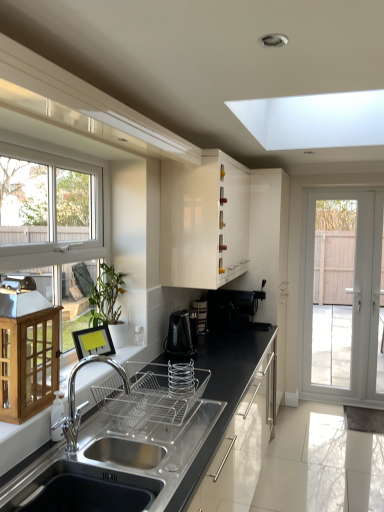
Question: In which direction should I rotate to look at black glossy electric kettle at center, which is the third appliance in back-to-front order?

Choices:
 (A) right
 (B) left

Answer: (B)

Question: Is white glossy cabinet at upper center, which ranks as the 2th cabinetry in bottom-to-top order, wider than black glossy electric kettle at center, the 2th appliance when ordered from front to back?

Choices:
 (A) yes
 (B) no

Answer: (A)

Question: Is white glossy cabinet at upper center, the second cabinetry when ordered from left to right, facing towards black glossy electric kettle at center, which is the third appliance in back-to-front order?

Choices:
 (A) no
 (B) yes

Answer: (A)

Question: Can you see white glossy cabinet at upper center, the 1th cabinetry when ordered from back to front, touching black glossy electric kettle at center, which is the third appliance in back-to-front order?

Choices:
 (A) no
 (B) yes

Answer: (A)

Question: Is white glossy cabinet at upper center, which ranks as the 2th cabinetry in bottom-to-top order, oriented away from black glossy electric kettle at center, which is the third appliance in back-to-front order?

Choices:
 (A) yes
 (B) no

Answer: (B)

Question: Can you confirm if white glossy cabinet at upper center, which is the 1th cabinetry in top-to-bottom order, is taller than black glossy electric kettle at center, which is the third appliance in back-to-front order?

Choices:
 (A) yes
 (B) no

Answer: (A)

Question: From the image's perspective, is white glossy cabinet at upper center, which is the 1th cabinetry in top-to-bottom order, above black glossy electric kettle at center, the 2th appliance when ordered from front to back?

Choices:
 (A) no
 (B) yes

Answer: (B)

Question: Is black plastic coffee maker at upper right, positioned as the 4th appliance in front-to-back order, touching satin black countertop at lower center?

Choices:
 (A) no
 (B) yes

Answer: (A)

Question: Would you say satin black countertop at lower center is part of black plastic coffee maker at upper right, positioned as the 4th appliance in front-to-back order,'s contents?

Choices:
 (A) no
 (B) yes

Answer: (A)

Question: Is black plastic coffee maker at upper right, which appears as the 1th appliance when viewed from the back, wider than satin black countertop at lower center?

Choices:
 (A) no
 (B) yes

Answer: (B)

Question: Can you confirm if black plastic coffee maker at upper right, positioned as the 4th appliance in front-to-back order, is thinner than satin black countertop at lower center?

Choices:
 (A) no
 (B) yes

Answer: (A)

Question: Can you confirm if black plastic coffee maker at upper right, which appears as the 1th appliance when viewed from the back, is positioned to the left of satin black countertop at lower center?

Choices:
 (A) yes
 (B) no

Answer: (B)

Question: From a real-world perspective, is black plastic coffee maker at upper right, which appears as the 1th appliance when viewed from the back, beneath satin black countertop at lower center?

Choices:
 (A) no
 (B) yes

Answer: (A)

Question: Would you say white glossy screen door at right is outside satin black countertop at lower center?

Choices:
 (A) no
 (B) yes

Answer: (B)